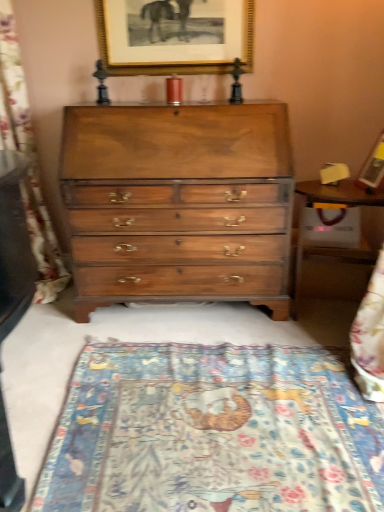
Question: Is wooden picture frame at upper right, the 1th picture frame from the bottom, wider or thinner than gold-framed picture at upper center, which is the 1th picture frame from top to bottom?

Choices:
 (A) thin
 (B) wide

Answer: (B)

Question: From a real-world perspective, relative to gold-framed picture at upper center, the 2th picture frame when ordered from bottom to top, is wooden picture frame at upper right, which is the 1th picture frame from right to left, vertically above or below?

Choices:
 (A) above
 (B) below

Answer: (B)

Question: Based on their relative distances, which object is farther from the shiny brown wood chest of drawers at center?

Choices:
 (A) patterned fabric mat at lower center
 (B) wooden table at right
 (C) wooden picture frame at upper right, which is the 1th picture frame from right to left
 (D) gold-framed picture at upper center, the 2th picture frame positioned from the front
 (E) blue woven tapestry at left

Answer: (C)

Question: Which is nearer to the gold-framed picture at upper center, which ranks as the first picture frame in back-to-front order?

Choices:
 (A) wooden table at right
 (B) shiny brown wood chest of drawers at center
 (C) blue woven tapestry at left
 (D) wooden picture frame at upper right, the second picture frame from the back
 (E) patterned fabric mat at lower center

Answer: (B)